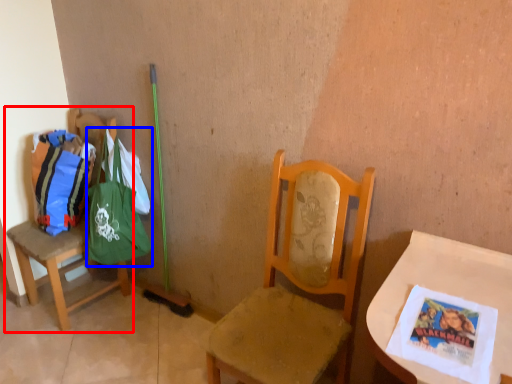
Question: Which object is further to the camera taking this photo, chair (highlighted by a red box) or shoulder bag (highlighted by a blue box)?

Choices:
 (A) chair
 (B) shoulder bag

Answer: (B)